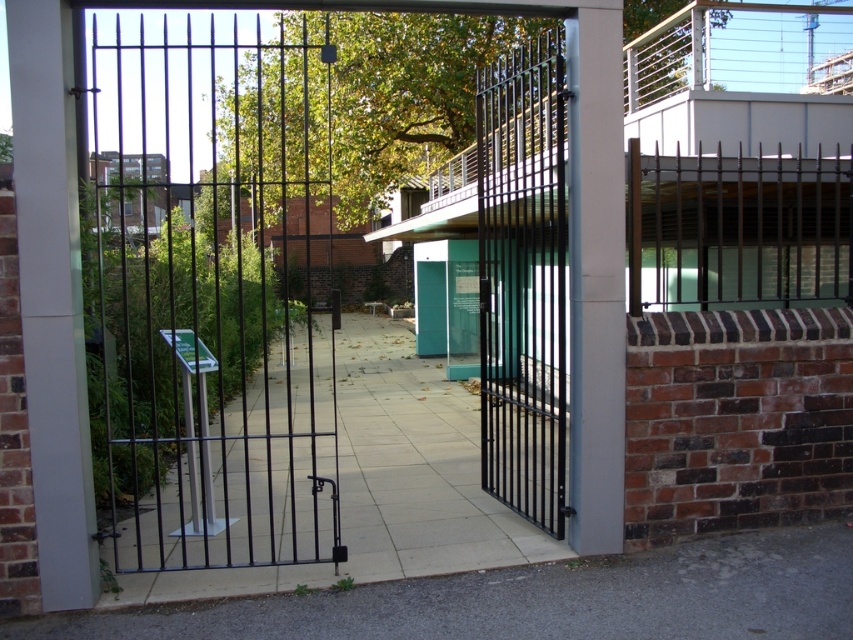
Question: Can you confirm if slate paving at center is wider than dark brown metal fence at upper right?

Choices:
 (A) no
 (B) yes

Answer: (A)

Question: Estimate the real-world distances between objects in this image. Which object is farther from the dark brown metal fence at upper right?

Choices:
 (A) slate paving at center
 (B) gray concrete pavement at lower center

Answer: (B)

Question: Is black metal fence at center to the left of dark brown metal fence at upper right from the viewer's perspective?

Choices:
 (A) yes
 (B) no

Answer: (A)

Question: Which point appears farthest from the camera in this image?

Choices:
 (A) (426, 436)
 (B) (677, 598)
 (C) (746, 188)
 (D) (241, 300)

Answer: (D)

Question: Is black metal fence at center below dark brown metal fence at upper right?

Choices:
 (A) no
 (B) yes

Answer: (A)

Question: Which of the following is the closest to the observer?

Choices:
 (A) (397, 616)
 (B) (163, 598)
 (C) (805, 218)
 (D) (125, 22)

Answer: (A)